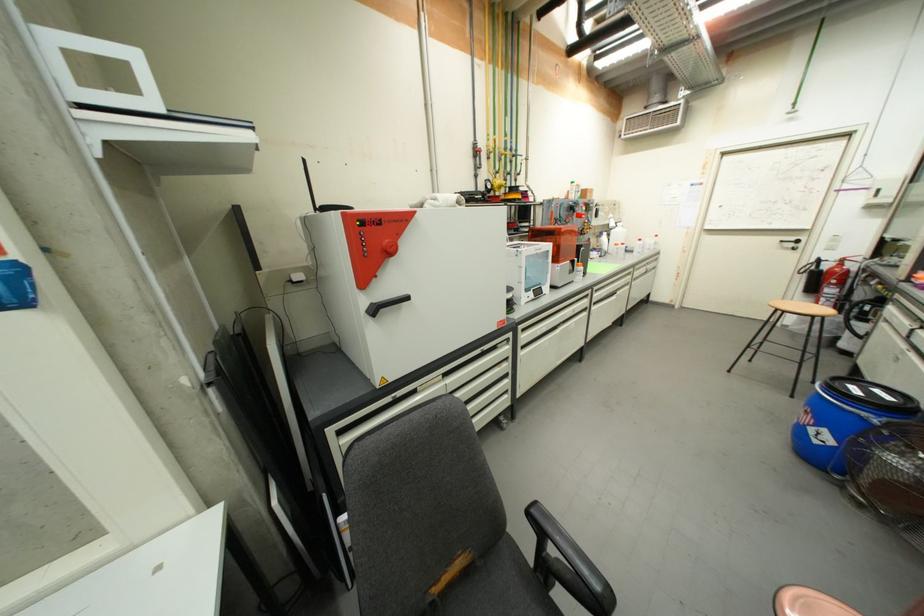
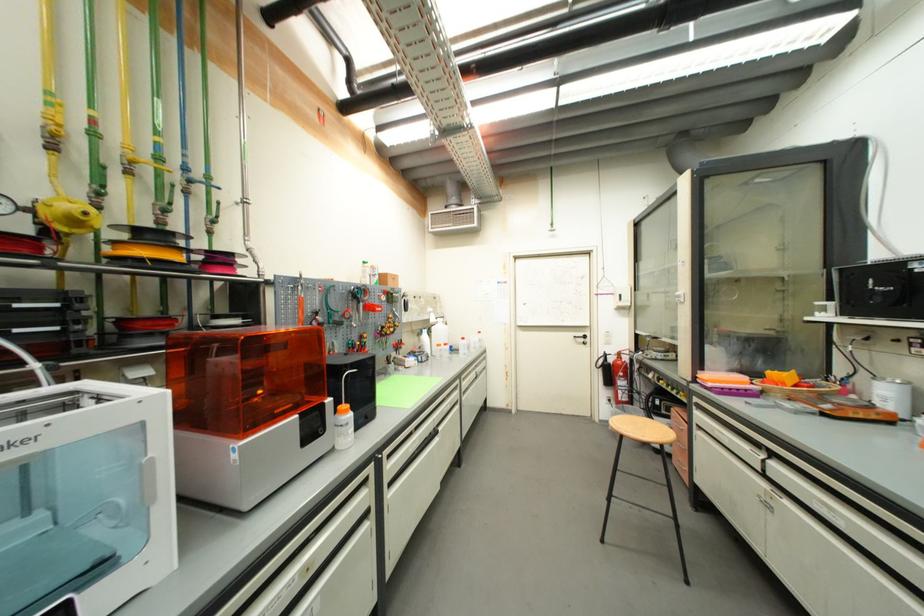
Where in the second image is the point corresponding to pixel 585 265 from the first image?

(349, 408)